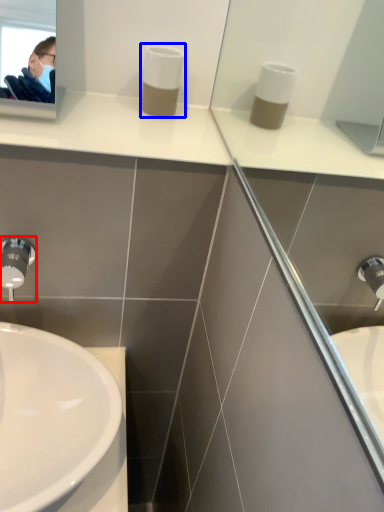
Question: Among these objects, which one is nearest to the camera, tap (highlighted by a red box) or soap dispenser (highlighted by a blue box)?

Choices:
 (A) tap
 (B) soap dispenser

Answer: (A)